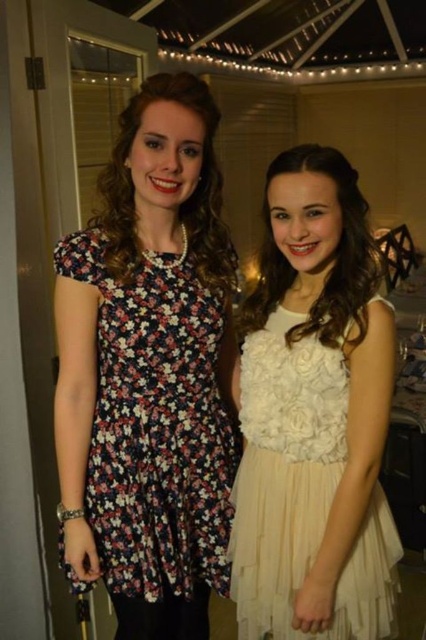
Is floral print fabric dress at left thinner than ivory tulle dress at center?

Incorrect, floral print fabric dress at left's width is not less than ivory tulle dress at center's.

Who is more distant from viewer, (138, 580) or (267, 376)?

Point (138, 580)

At what (x,y) coordinates should I click in order to perform the action: click on floral print fabric dress at left. Please return your answer as a coordinate pair (x, y). The height and width of the screenshot is (640, 426). Looking at the image, I should click on (157, 424).